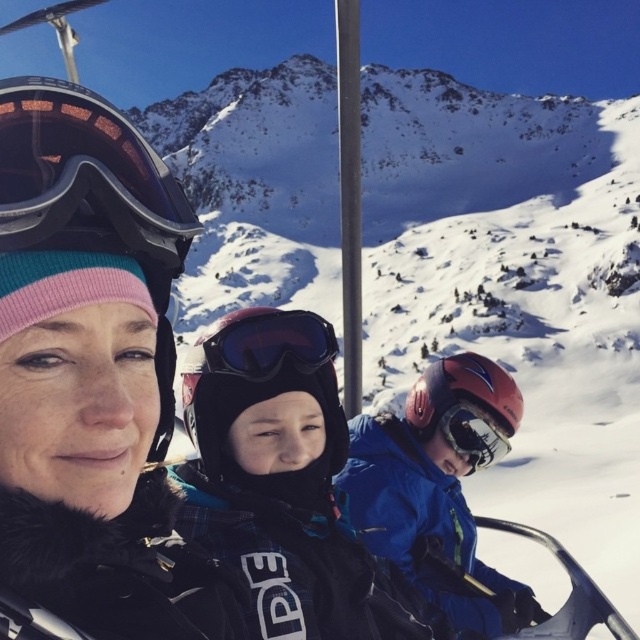
Is matte black helmet at center to the right of blue matte jacket at center from the viewer's perspective?

Incorrect, matte black helmet at center is not on the right side of blue matte jacket at center.

Can you confirm if matte black helmet at center is smaller than blue matte jacket at center?

Yes.

Does point (112, 522) lie behind point (422, 520)?

No, (112, 522) is in front of (422, 520).

The height and width of the screenshot is (640, 640). What are the coordinates of `matte black helmet at center` in the screenshot? It's located at (147, 355).

Is black matte ski jacket at center thinner than transparent blue lens goggles at center?

Incorrect, black matte ski jacket at center's width is not less than transparent blue lens goggles at center's.

Does black matte ski jacket at center have a lesser height compared to transparent blue lens goggles at center?

In fact, black matte ski jacket at center may be taller than transparent blue lens goggles at center.

Who is more forward, [337,566] or [280,324]?

Point [337,566] is more forward.

Identify the location of black matte ski jacket at center. (280, 477).

Is matte black helmet at center in front of matte black goggles at upper left?

Yes, it is.

Does point (157, 589) come in front of point (1, 122)?

No, (157, 589) is further to viewer.

You are a GUI agent. You are given a task and a screenshot of the screen. Output one action in this format:
    pyautogui.click(x=<x>, y=<y>)
    Task: Click on the matte black helmet at center
    
    Given the screenshot: What is the action you would take?
    pyautogui.click(x=147, y=355)